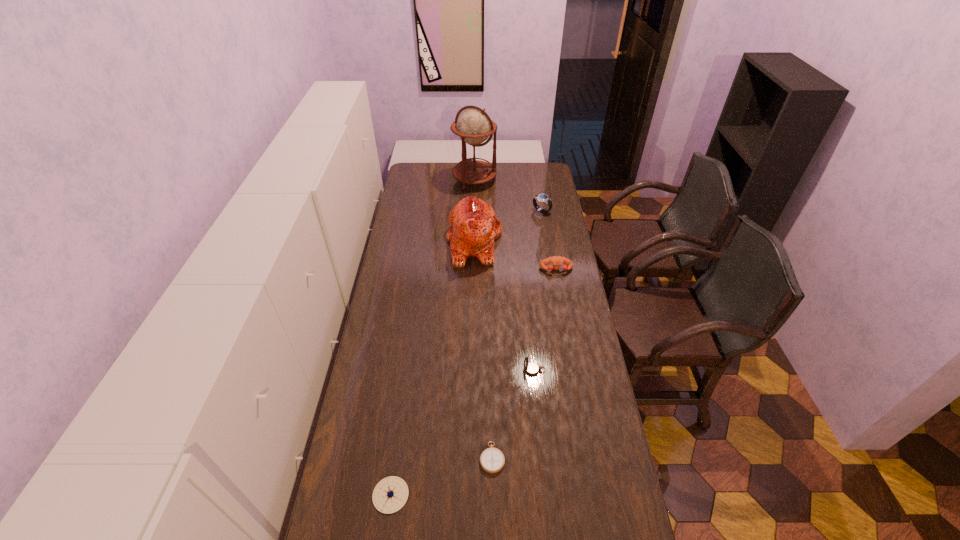
The image size is (960, 540). In order to click on the second farthest compass in this screenshot , I will do `click(492, 460)`.

Locate an element on the screen. Image resolution: width=960 pixels, height=540 pixels. blank area located 0.380m on the surface of the globe is located at coordinates tap(473, 235).

Locate an element on the screen. vacant space situated 0.320m on the face of the second tallest object is located at coordinates (568, 241).

What are the coordinates of `vacant point located on the back of the sixth nearest object` in the screenshot? It's located at click(537, 183).

I want to click on blank area located 0.140m on the face of the fifth object from left to right, so click(485, 370).

This screenshot has height=540, width=960. Find the location of `vacant region located 0.210m on the face of the fifth object from left to right`. vacant region located 0.210m on the face of the fifth object from left to right is located at coordinates (466, 370).

This screenshot has height=540, width=960. Identify the location of vacant space positioned on the face of the fifth object from left to right. (424, 370).

I want to click on free space located with the gloves of the puncher facing forward, so click(567, 330).

Where is `vacant space located 0.300m on the back of the nearest compass`? The image size is (960, 540). vacant space located 0.300m on the back of the nearest compass is located at coordinates (405, 390).

Where is `free space located 0.310m on the right of the second nearest compass`? free space located 0.310m on the right of the second nearest compass is located at coordinates (604, 457).